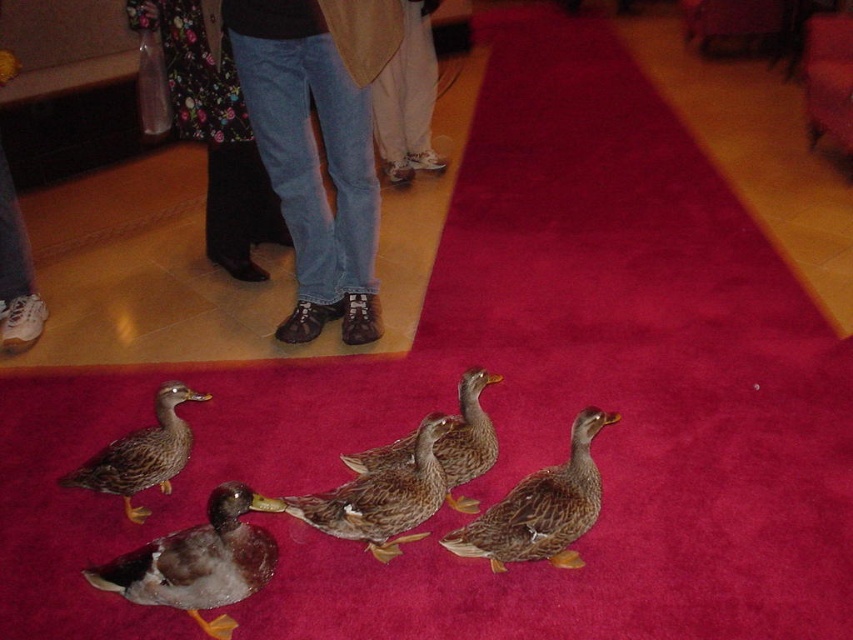
You are a photographer trying to capture a clear shot of the brown speckled duck at center and the white cotton pants at center. Based on their positions, which object is blocking the view of the other?

The brown speckled duck at center is positioned under the white cotton pants at center, so the white cotton pants at center is blocking the view of the brown speckled duck at center.

Looking at this image, you are standing at the origin of the coordinate system in the image. There is a brown speckled duck at center marked by point [381,497]. If you want to walk towards this duck, in which direction should you move?

You should move towards the coordinates [381,497], which is the location of the brown speckled duck at center.

You are standing at point (410, 99) and want to walk to point (386, 532). Are you walking towards or away from the ducks?

You are walking towards the ducks because point (386, 532) is in front of point (410, 99), which means the direction of travel is toward the ducks.